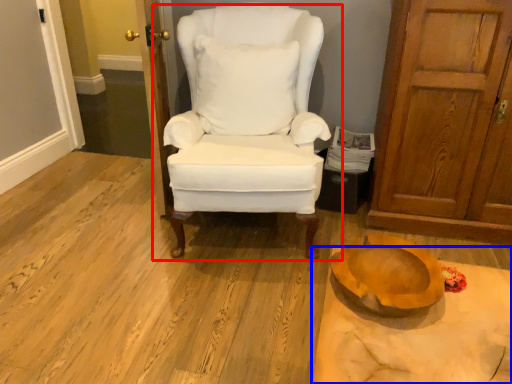
Question: Which point is closer to the camera, chair (highlighted by a red box) or table (highlighted by a blue box)?

Choices:
 (A) chair
 (B) table

Answer: (B)